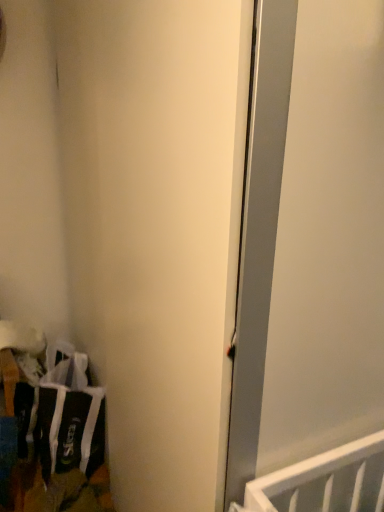
Locate an element on the screen. This screenshot has height=512, width=384. white matte door at center is located at coordinates (155, 229).

The height and width of the screenshot is (512, 384). What do you see at coordinates (155, 229) in the screenshot?
I see `white matte door at center` at bounding box center [155, 229].

Measure the distance between point [73,70] and camera.

Point [73,70] and camera are 5.13 feet apart from each other.

At what (x,y) coordinates should I click in order to perform the action: click on black fabric laundry at lower left. Please return your answer as a coordinate pair (x, y). This screenshot has width=384, height=512. Looking at the image, I should click on (65, 418).

This screenshot has height=512, width=384. What do you see at coordinates (65, 418) in the screenshot?
I see `black fabric laundry at lower left` at bounding box center [65, 418].

In order to click on white matte door at center in this screenshot , I will do `click(155, 229)`.

Considering the positions of objects white matte door at center and black fabric laundry at lower left in the image provided, who is more to the left, white matte door at center or black fabric laundry at lower left?

black fabric laundry at lower left is more to the left.

Between white matte door at center and black fabric laundry at lower left, which one is positioned behind?

black fabric laundry at lower left is further from the camera.

Between point (151, 312) and point (19, 442), which one is positioned behind?

The point (19, 442) is farther from the camera.

From the image's perspective, is white matte door at center below black fabric laundry at lower left?

No, from the image's perspective, white matte door at center is not beneath black fabric laundry at lower left.

Based on the photo, from a real-world perspective, which is physically below, white matte door at center or black fabric laundry at lower left?

black fabric laundry at lower left.

Considering the sizes of objects white matte door at center and black fabric laundry at lower left in the image provided, who is wider, white matte door at center or black fabric laundry at lower left?

white matte door at center.

Considering the sizes of objects white matte door at center and black fabric laundry at lower left in the image provided, who is shorter, white matte door at center or black fabric laundry at lower left?

black fabric laundry at lower left is shorter.

Is white matte door at center bigger than black fabric laundry at lower left?

Yes.

Is black fabric laundry at lower left located within white matte door at center?

No, black fabric laundry at lower left is not surrounded by white matte door at center.

Is white matte door at center placed right next to black fabric laundry at lower left?

No, white matte door at center is not beside black fabric laundry at lower left.

Could you tell me if white matte door at center is turned towards black fabric laundry at lower left?

Yes, white matte door at center is aimed at black fabric laundry at lower left.

What's the angular difference between white matte door at center and black fabric laundry at lower left's facing directions?

89 degrees separate the facing orientations of white matte door at center and black fabric laundry at lower left.

The width and height of the screenshot is (384, 512). In order to click on door above the black fabric laundry at lower left (from the image's perspective) in this screenshot , I will do `click(155, 229)`.

Considering the positions of objects black fabric laundry at lower left and white matte door at center in the image provided, who is more to the right, black fabric laundry at lower left or white matte door at center?

white matte door at center is more to the right.

Considering the positions of objects black fabric laundry at lower left and white matte door at center in the image provided, who is in front, black fabric laundry at lower left or white matte door at center?

white matte door at center.

Is point (100, 432) in front of point (230, 25)?

No.

From the image's perspective, which one is positioned higher, black fabric laundry at lower left or white matte door at center?

white matte door at center appears higher in the image.

From a real-world perspective, who is located lower, black fabric laundry at lower left or white matte door at center?

black fabric laundry at lower left, from a real-world perspective.

Considering the sizes of black fabric laundry at lower left and white matte door at center in the image, is black fabric laundry at lower left wider or thinner than white matte door at center?

In the image, black fabric laundry at lower left appears to be more narrow than white matte door at center.

Does black fabric laundry at lower left have a greater height compared to white matte door at center?

No, black fabric laundry at lower left is not taller than white matte door at center.

Which of these two, black fabric laundry at lower left or white matte door at center, is bigger?

Bigger between the two is white matte door at center.

Is black fabric laundry at lower left spatially inside white matte door at center, or outside of it?

black fabric laundry at lower left is spatially situated outside white matte door at center.

Is black fabric laundry at lower left far from white matte door at center?

Actually, black fabric laundry at lower left and white matte door at center are a little close together.

Consider the image. Does black fabric laundry at lower left turn towards white matte door at center?

No, black fabric laundry at lower left is not oriented towards white matte door at center.

Image resolution: width=384 pixels, height=512 pixels. I want to click on laundry located below the white matte door at center (from the image's perspective), so click(x=65, y=418).

The width and height of the screenshot is (384, 512). In order to click on door lying above the black fabric laundry at lower left (from the image's perspective) in this screenshot , I will do pos(155,229).

Locate an element on the screen. laundry located below the white matte door at center (from the image's perspective) is located at coordinates (65, 418).